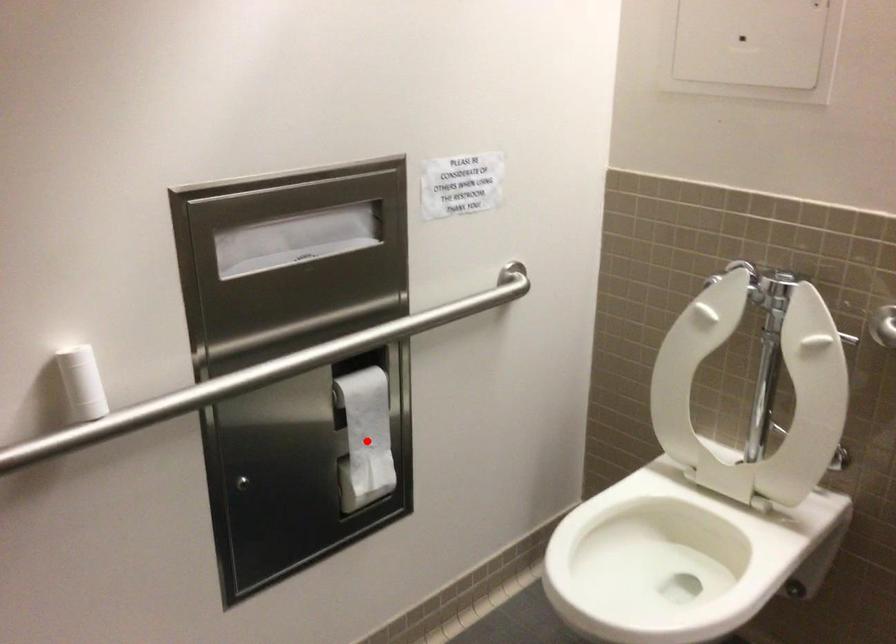
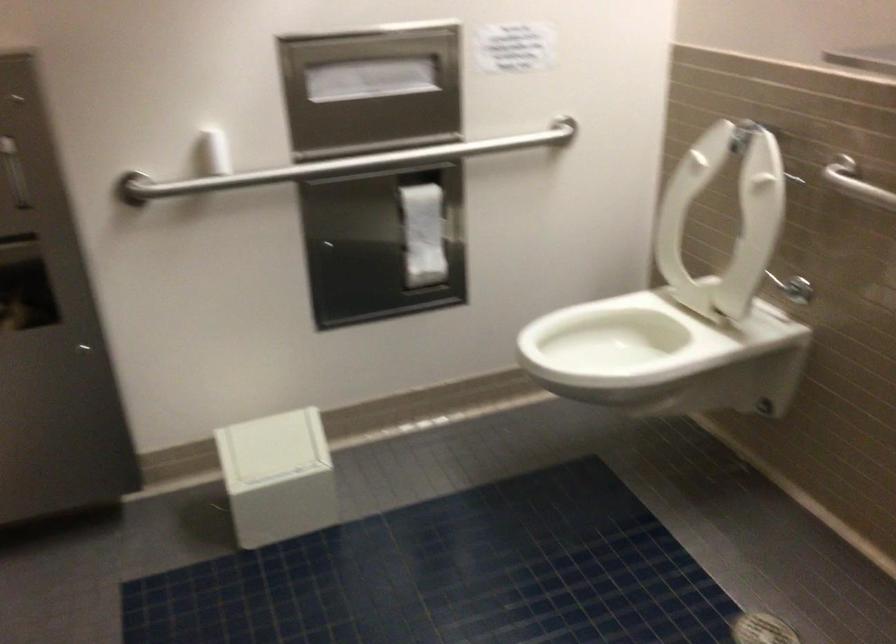
Question: I am providing you with two images of the same scene from different viewpoints. In image1, a red point is highlighted. Considering the same 3D point in image2, which of the following is correct?

Choices:
 (A) It is closer
 (B) It is farther

Answer: (B)